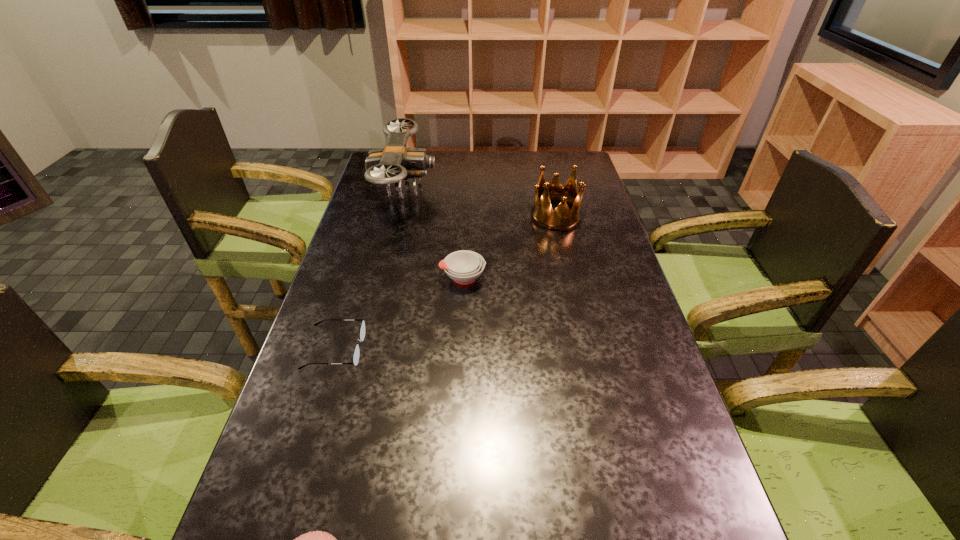
Locate an element on the screen. Image resolution: width=960 pixels, height=540 pixels. drone is located at coordinates (394, 163).

Locate an element on the screen. The width and height of the screenshot is (960, 540). the rightmost object is located at coordinates click(561, 218).

The height and width of the screenshot is (540, 960). Identify the location of the fourth shortest object. (561, 218).

Where is `the third nearest object`? the third nearest object is located at coordinates (464, 266).

Find the location of a particular element. The image size is (960, 540). the third shortest object is located at coordinates (464, 266).

Where is `the second nearest object`? the second nearest object is located at coordinates (356, 354).

Where is `free point located 0.270m on the front-facing side of the drone`? Image resolution: width=960 pixels, height=540 pixels. free point located 0.270m on the front-facing side of the drone is located at coordinates (510, 190).

Locate an element on the screen. The height and width of the screenshot is (540, 960). vacant space located on the left of the second tallest object is located at coordinates (481, 216).

The width and height of the screenshot is (960, 540). What are the coordinates of `free spot located on the back of the soup bowl` in the screenshot? It's located at (466, 205).

Locate an element on the screen. The width and height of the screenshot is (960, 540). vacant area situated on the lenses of the spectacles is located at coordinates (486, 349).